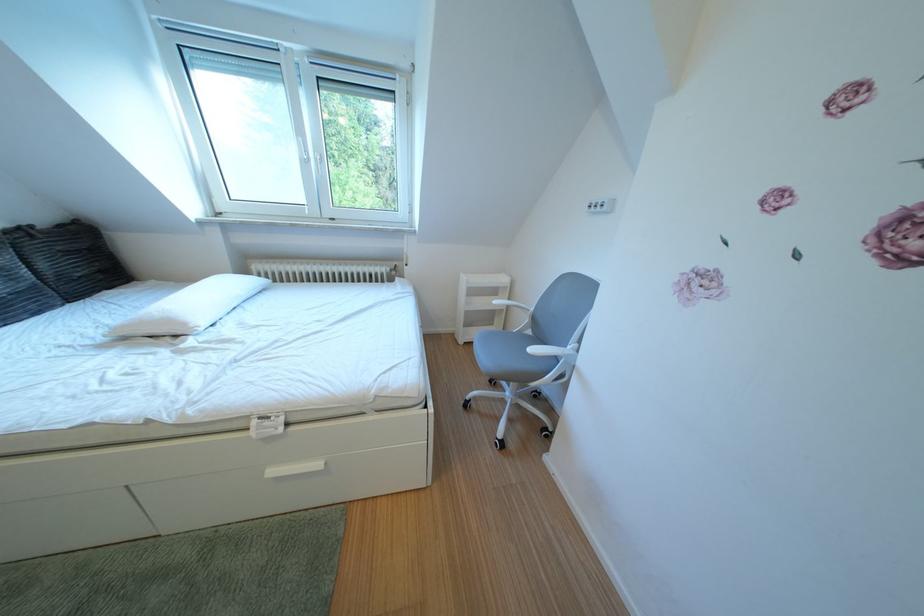
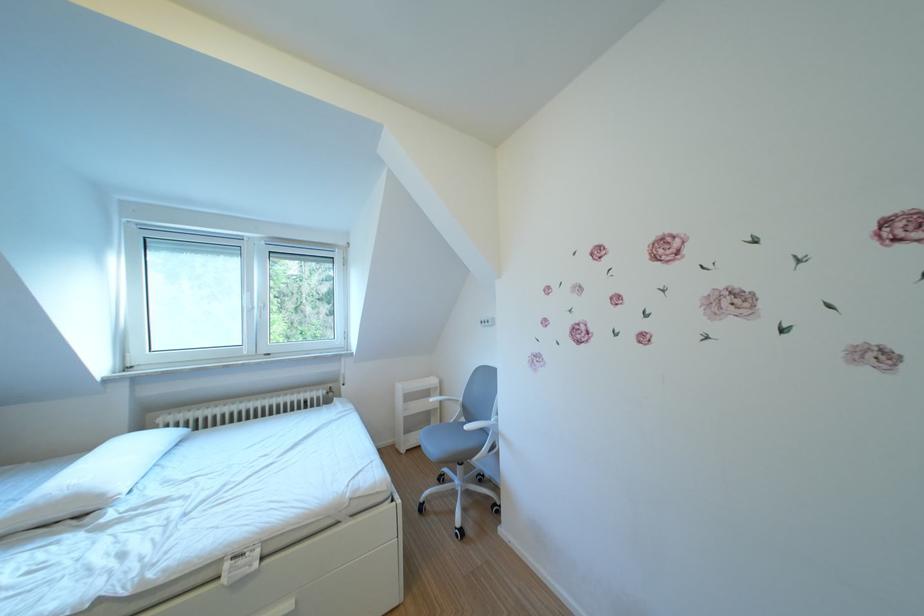
The point at (507, 297) is marked in the first image. Where is the corresponding point in the second image?

(440, 399)